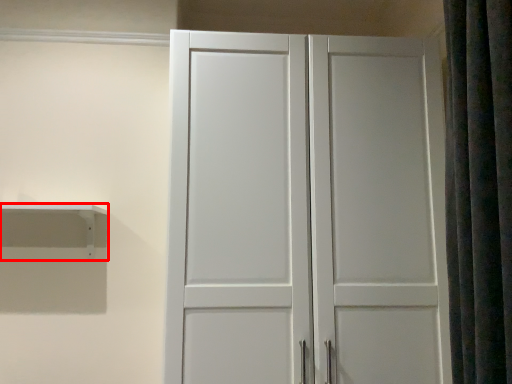
Question: From the image, what is the correct spatial relationship of shelf (annotated by the red box) in relation to shower curtain?

Choices:
 (A) left
 (B) right

Answer: (A)